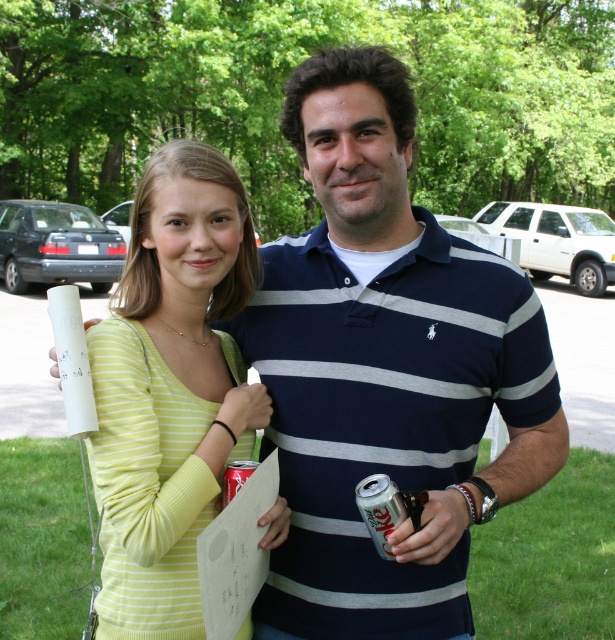
Is silver metallic can at lower center in front of silver metallic can at center?

That is True.

Does point (399, 499) lie behind point (244, 467)?

No, (399, 499) is in front of (244, 467).

Between point (383, 483) and point (236, 486), which one is positioned behind?

The point (236, 486) is more distant.

Locate an element on the screen. This screenshot has height=640, width=615. silver metallic can at lower center is located at coordinates (381, 509).

Can you confirm if navy blue striped polo shirt at center is positioned below yellow striped sweater at center?

Correct, navy blue striped polo shirt at center is located below yellow striped sweater at center.

Between point (328, 385) and point (121, 602), which one is positioned in front?

Positioned in front is point (121, 602).

Locate an element on the screen. This screenshot has height=640, width=615. navy blue striped polo shirt at center is located at coordinates (383, 416).

Is navy blue striped polo shirt at center smaller than silver metallic can at lower center?

No.

How far apart are navy blue striped polo shirt at center and silver metallic can at lower center?

10.39 inches

Does point (391, 621) lie behind point (359, 506)?

Yes.

Find the location of a particular element. navy blue striped polo shirt at center is located at coordinates (383, 416).